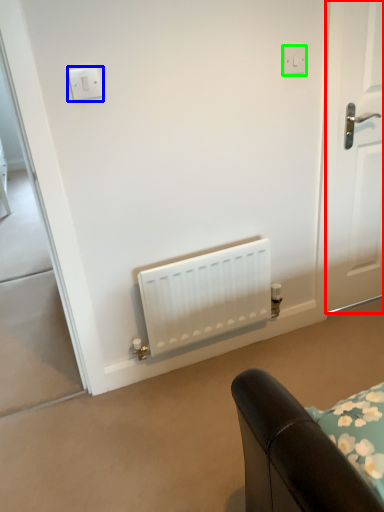
Question: Based on their relative distances, which object is nearer to door (highlighted by a red box)? Choose from light switch (highlighted by a blue box) and electric outlet (highlighted by a green box).

Choices:
 (A) light switch
 (B) electric outlet

Answer: (B)